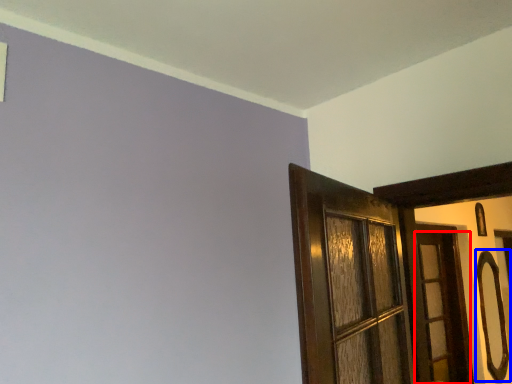
Question: Which object appears closest to the camera in this image, door (highlighted by a red box) or door handle (highlighted by a blue box)?

Choices:
 (A) door
 (B) door handle

Answer: (A)